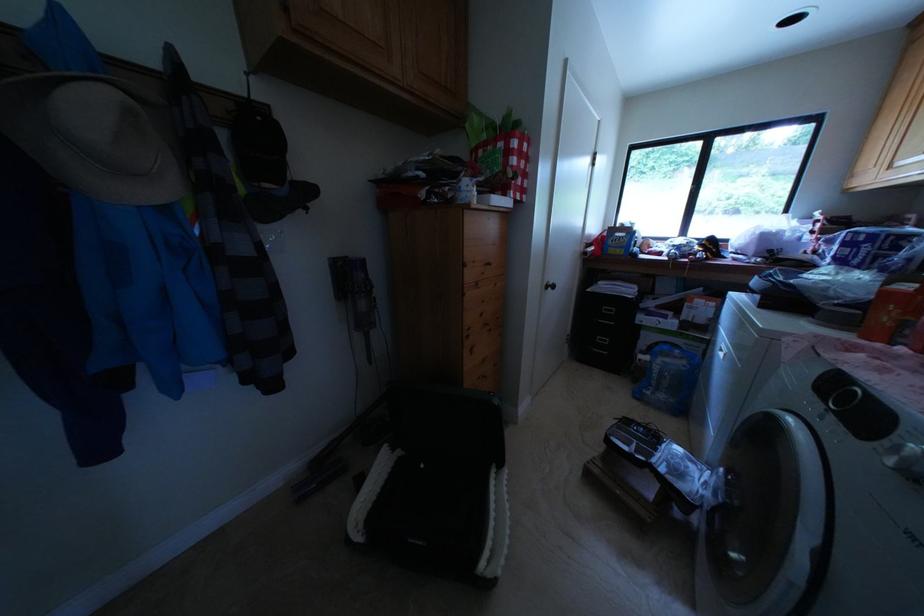
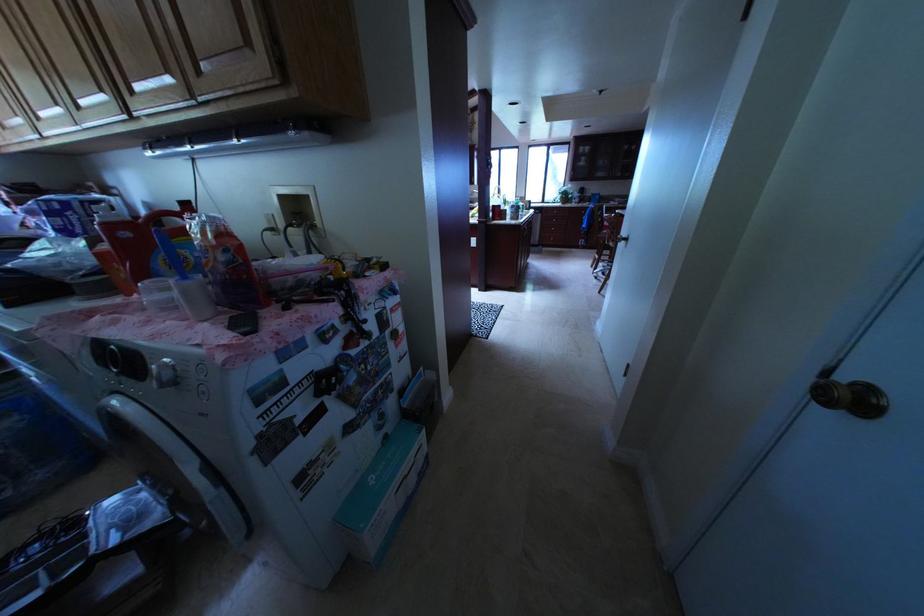
How did the camera likely rotate?

The camera's rotation is toward right-down.